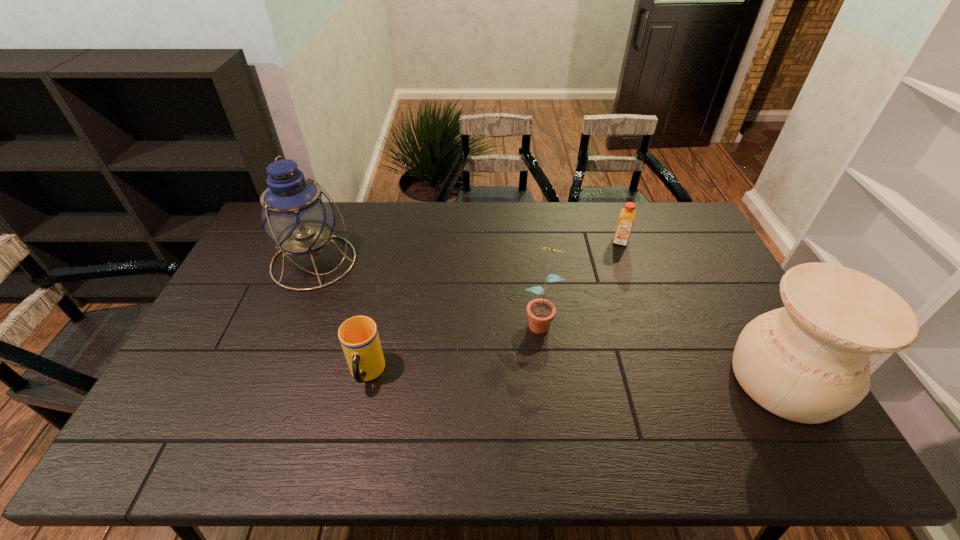
The width and height of the screenshot is (960, 540). I want to click on vacant region between the second object from right to left and the leftmost object, so click(x=467, y=252).

Image resolution: width=960 pixels, height=540 pixels. In order to click on free space between the fourth object from left to right and the rightmost object in this screenshot , I will do `click(702, 310)`.

Locate an element on the screen. The width and height of the screenshot is (960, 540). free point between the fourth object from right to left and the second object from right to left is located at coordinates (493, 307).

This screenshot has height=540, width=960. I want to click on free spot between the fourth object from left to right and the cup, so click(x=493, y=307).

This screenshot has height=540, width=960. In order to click on unoccupied position between the cup and the leftmost object in this screenshot , I will do `click(340, 318)`.

Where is `unoccupied position between the second object from right to left and the cup`? unoccupied position between the second object from right to left and the cup is located at coordinates (493, 307).

In order to click on empty space between the fourth object from left to right and the fourth object from right to left in this screenshot , I will do (493, 307).

Find the location of `empty space that is in between the sunflower and the fourth object from right to left`. empty space that is in between the sunflower and the fourth object from right to left is located at coordinates 453,347.

Locate an element on the screen. free point between the pottery and the second object from right to left is located at coordinates (702, 310).

Identify the location of empty space that is in between the third object from right to left and the leftmost object. The width and height of the screenshot is (960, 540). (427, 291).